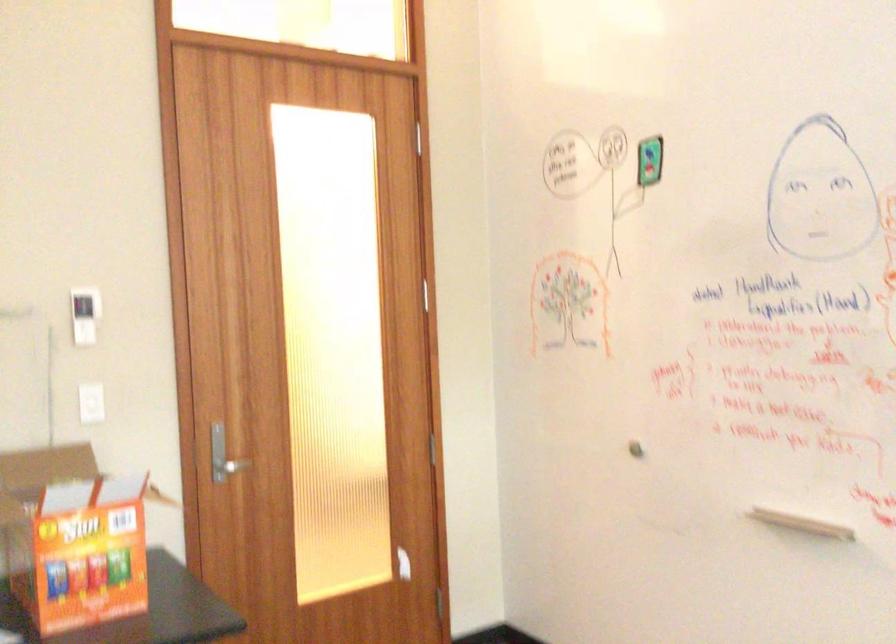
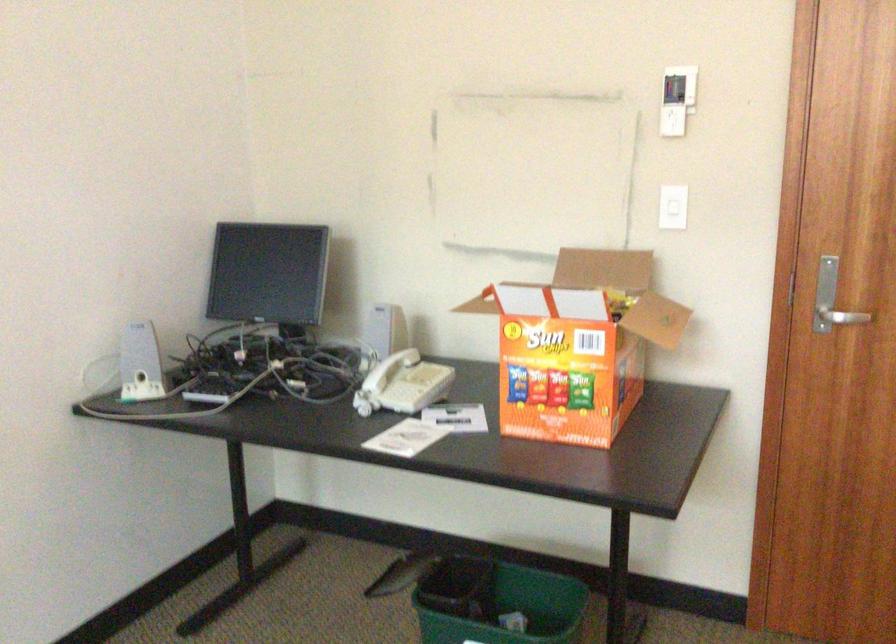
Where in the second image is the point corresponding to pixel 235 466 from the first image?

(842, 317)